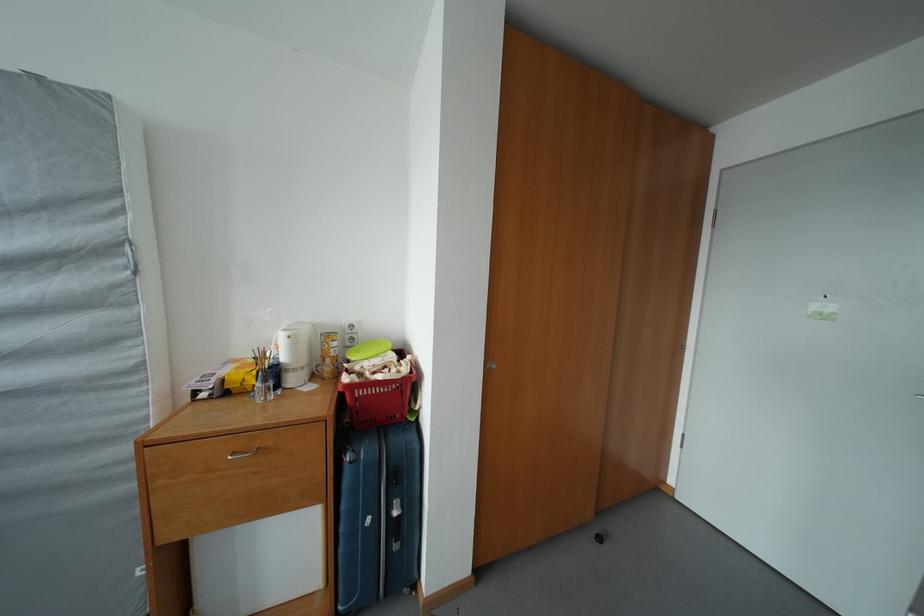
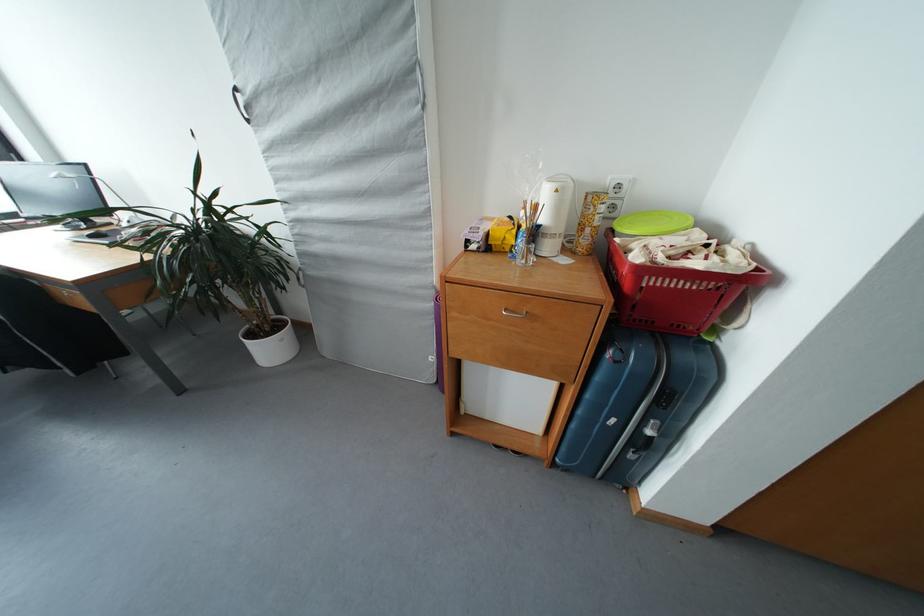
Where in the second image is the point corresponding to (296,342) from the first image?

(563, 196)